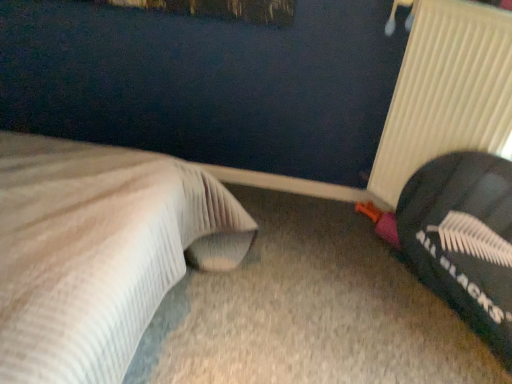
Question: Considering the relative sizes of black fabric bean bag at right and white ribbed radiator at right in the image provided, is black fabric bean bag at right shorter than white ribbed radiator at right?

Choices:
 (A) no
 (B) yes

Answer: (A)

Question: Is black fabric bean bag at right positioned far away from white ribbed radiator at right?

Choices:
 (A) no
 (B) yes

Answer: (A)

Question: From a real-world perspective, is black fabric bean bag at right positioned under white ribbed radiator at right based on gravity?

Choices:
 (A) no
 (B) yes

Answer: (B)

Question: Is black fabric bean bag at right bigger than white ribbed radiator at right?

Choices:
 (A) no
 (B) yes

Answer: (B)

Question: Is black fabric bean bag at right turned away from white ribbed radiator at right?

Choices:
 (A) no
 (B) yes

Answer: (B)

Question: Is black fabric bean bag at right positioned before white ribbed radiator at right?

Choices:
 (A) no
 (B) yes

Answer: (B)

Question: Are white textured bed at left and black fabric bean bag at right far apart?

Choices:
 (A) yes
 (B) no

Answer: (A)

Question: Is white textured bed at left in contact with black fabric bean bag at right?

Choices:
 (A) no
 (B) yes

Answer: (A)

Question: Is white textured bed at left closer to camera compared to black fabric bean bag at right?

Choices:
 (A) no
 (B) yes

Answer: (B)

Question: From a real-world perspective, is white textured bed at left located beneath black fabric bean bag at right?

Choices:
 (A) yes
 (B) no

Answer: (B)

Question: Would you say white textured bed at left is outside black fabric bean bag at right?

Choices:
 (A) no
 (B) yes

Answer: (B)

Question: Is white textured bed at left facing towards black fabric bean bag at right?

Choices:
 (A) no
 (B) yes

Answer: (B)

Question: Is white ribbed radiator at right not close to white textured bed at left?

Choices:
 (A) yes
 (B) no

Answer: (A)